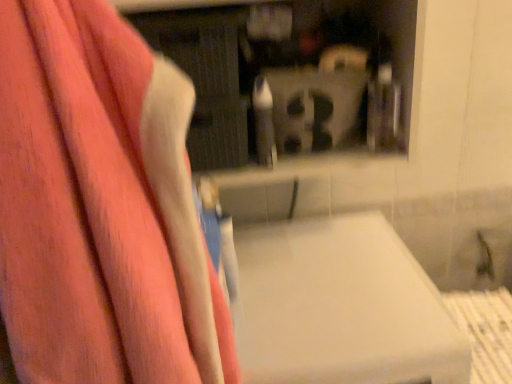
Question: Based on their sizes in the image, would you say white matte lift at center is bigger or smaller than pink fabric towel at left?

Choices:
 (A) small
 (B) big

Answer: (B)

Question: Looking at their shapes, would you say white matte lift at center is wider or thinner than pink fabric towel at left?

Choices:
 (A) thin
 (B) wide

Answer: (B)

Question: Estimate the real-world distances between objects in this image. Which object is closer to the white matte lift at center?

Choices:
 (A) pink fabric towel at left
 (B) matte plastic shelf at upper center

Answer: (A)

Question: Which object is positioned farthest from the pink fabric towel at left?

Choices:
 (A) matte plastic shelf at upper center
 (B) white matte lift at center

Answer: (A)